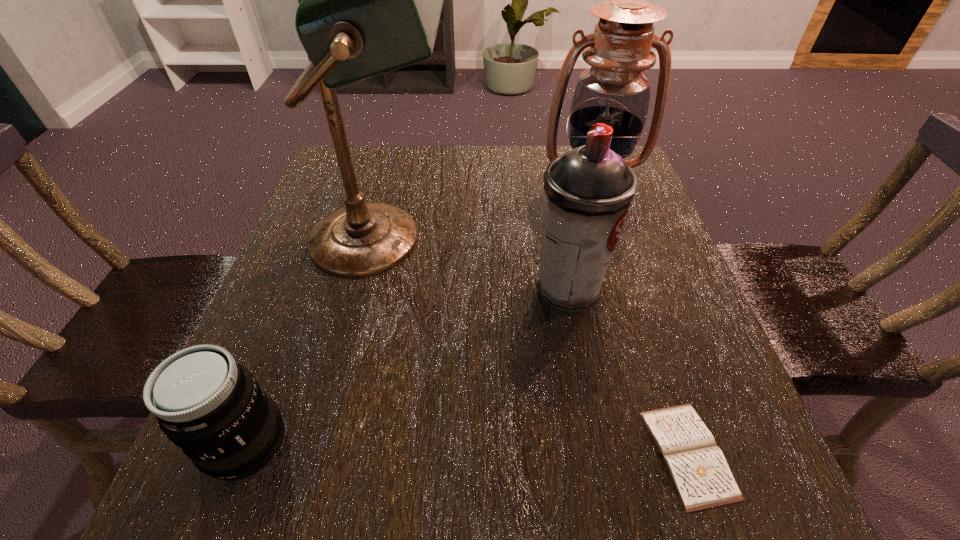
Identify the location of table lamp that is at the far edge. Image resolution: width=960 pixels, height=540 pixels. (371, 3).

Locate an element on the screen. This screenshot has height=540, width=960. oil lamp present at the far edge is located at coordinates (613, 91).

Find the location of a particular element. The image size is (960, 540). telephoto lens situated at the near edge is located at coordinates (212, 407).

This screenshot has width=960, height=540. What are the coordinates of `diary positioned at the near edge` in the screenshot? It's located at (697, 467).

The height and width of the screenshot is (540, 960). Find the location of `table lamp located in the left edge section of the desktop`. table lamp located in the left edge section of the desktop is located at coordinates (371, 3).

In order to click on telephoto lens present at the left edge in this screenshot , I will do `click(212, 407)`.

Identify the location of oil lamp that is at the right edge. This screenshot has height=540, width=960. (613, 91).

In order to click on aerosol can situated at the right edge in this screenshot , I will do [x=587, y=192].

Identify the location of diary present at the right edge. coord(697,467).

Identify the location of object positioned at the far left corner. The image size is (960, 540). (371, 3).